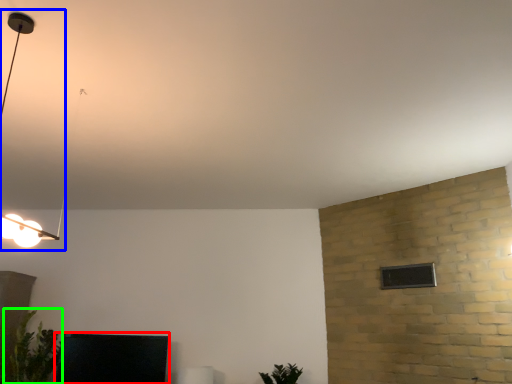
Question: Estimate the real-world distances between objects in this image. Which object is farther from furniture (highlighted by a red box), lamp (highlighted by a blue box) or plant (highlighted by a green box)?

Choices:
 (A) lamp
 (B) plant

Answer: (A)